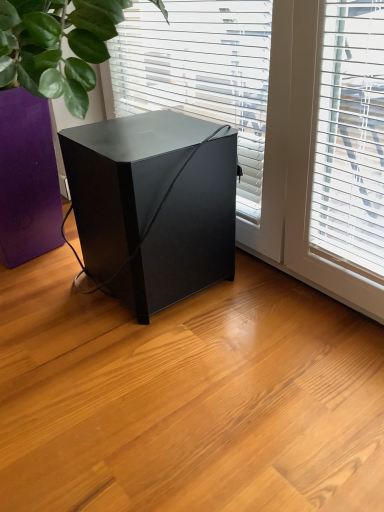
What is the approximate width of matte black speaker at center?

Answer: The width of matte black speaker at center is 15.89 inches.

This screenshot has width=384, height=512. What do you see at coordinates (154, 205) in the screenshot? I see `matte black speaker at center` at bounding box center [154, 205].

In order to face matte black speaker at center, should I rotate leftwards or rightwards?

Turn left by 4.525 degrees to look at matte black speaker at center.

Find the location of `matte black speaker at center`. matte black speaker at center is located at coordinates (154, 205).

At what (x,y) coordinates should I click in order to perform the action: click on matte black speaker at center. Please return your answer as a coordinate pair (x, y). Looking at the image, I should click on (154, 205).